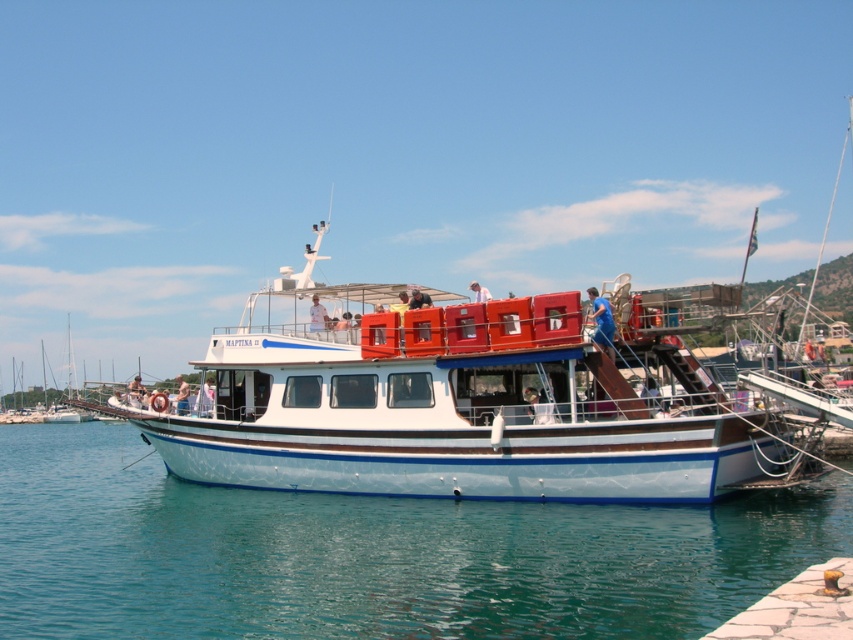
Question: Which point is farther to the camera?

Choices:
 (A) blue fabric shirt at upper center
 (B) matte orange life preserver at upper center

Answer: (B)

Question: Does transparent blue water at lower left appear on the right side of blue fabric shirt at upper center?

Choices:
 (A) yes
 (B) no

Answer: (B)

Question: Which object is the closest to the matte orange life preserver at upper center?

Choices:
 (A) white fabric shirt at upper center
 (B) light blue fabric shirt at upper center
 (C) blue fabric shirt at upper center
 (D) white polished wood boat at center

Answer: (A)

Question: Which object appears closest to the camera in this image?

Choices:
 (A) transparent blue water at lower left
 (B) white fabric shirt at upper center

Answer: (A)

Question: Is blue fabric shirt at upper center thinner than matte orange life preserver at upper center?

Choices:
 (A) no
 (B) yes

Answer: (A)

Question: Is transparent blue water at lower left closer to the viewer compared to matte orange life preserver at upper center?

Choices:
 (A) no
 (B) yes

Answer: (B)